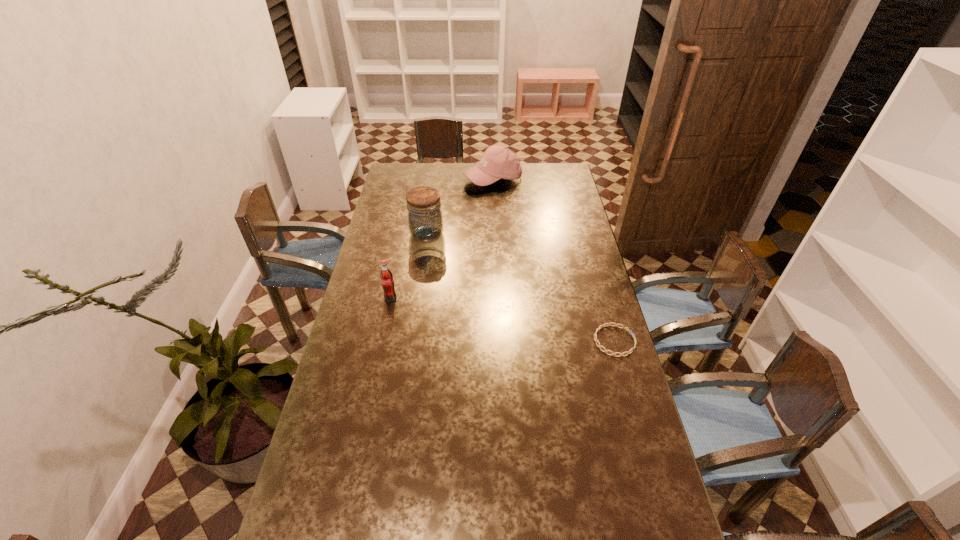
At what (x,y) coordinates should I click in order to perform the action: click on free space that satisfies the following two spatial constraints: 1. on the back side of the second farthest object; 2. on the right side of the third object from left to right. Please return your answer as a coordinate pair (x, y). The width and height of the screenshot is (960, 540). Looking at the image, I should click on (435, 179).

Locate an element on the screen. Image resolution: width=960 pixels, height=540 pixels. free space that satisfies the following two spatial constraints: 1. on the label of the third farthest object; 2. on the surface of the rightmost object showing star-shaped elements is located at coordinates (381, 341).

In order to click on free spot that satisfies the following two spatial constraints: 1. on the front side of the jar; 2. on the surface of the shortest object showing star-shaped elements in this screenshot , I will do `click(412, 341)`.